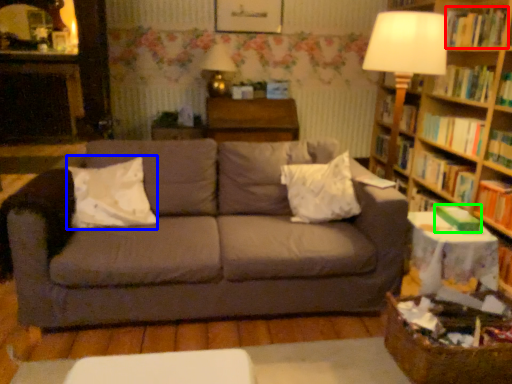
Question: Which is farther away from book (highlighted by a red box)? pillow (highlighted by a blue box) or paperback book (highlighted by a green box)?

Choices:
 (A) pillow
 (B) paperback book

Answer: (A)